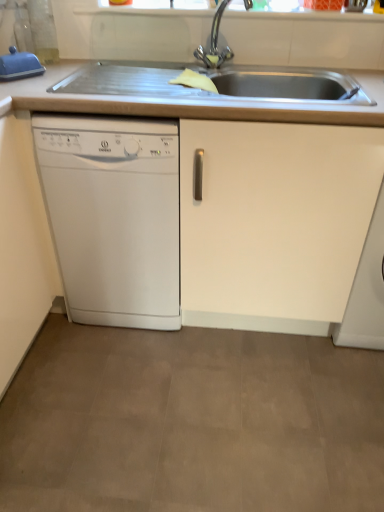
What do you see at coordinates (366, 291) in the screenshot?
I see `white matte cabinet at lower right` at bounding box center [366, 291].

You are a GUI agent. You are given a task and a screenshot of the screen. Output one action in this format:
    pyautogui.click(x=<x>, y=<y>)
    Task: Click on the white matte countertop at upper center
    Image resolution: width=384 pixels, height=512 pixels.
    Given the screenshot: What is the action you would take?
    pyautogui.click(x=179, y=97)

The image size is (384, 512). Identify the location of blue rubber glove at upper left. (19, 65).

Which object is further away from the camera, polished chrome tap at upper center or white matte cabinet at lower right?

polished chrome tap at upper center is more distant.

Which object is positioned more to the left, polished chrome tap at upper center or white matte cabinet at lower right?

polished chrome tap at upper center is more to the left.

From a real-world perspective, is polished chrome tap at upper center positioned over white matte cabinet at lower right based on gravity?

Correct, in the physical world, polished chrome tap at upper center is higher than white matte cabinet at lower right.

Is white plastic dishwasher at left turned away from polished chrome tap at upper center?

No.

Considering the positions of points (77, 280) and (222, 52), is point (77, 280) closer to camera compared to point (222, 52)?

No, (77, 280) is further to viewer.

From the image's perspective, would you say white plastic dishwasher at left is shown under polished chrome tap at upper center?

Indeed, from the image's perspective, white plastic dishwasher at left is shown beneath polished chrome tap at upper center.

From a real-world perspective, is white plastic dishwasher at left located beneath polished chrome tap at upper center?

Yes, from a real-world perspective, white plastic dishwasher at left is beneath polished chrome tap at upper center.

Considering the sizes of white matte cabinet at lower right and white matte countertop at upper center in the image, is white matte cabinet at lower right wider or thinner than white matte countertop at upper center?

Clearly, white matte cabinet at lower right has more width compared to white matte countertop at upper center.

Is white matte cabinet at lower right further to camera compared to white matte countertop at upper center?

Yes, white matte cabinet at lower right is behind white matte countertop at upper center.

Is white matte cabinet at lower right next to white matte countertop at upper center and touching it?

white matte cabinet at lower right and white matte countertop at upper center are clearly separated.

From a real-world perspective, does white matte cabinet at lower right stand above white matte countertop at upper center?

No, from a real-world perspective, white matte cabinet at lower right is not over white matte countertop at upper center

Based on the photo, in the image, is blue rubber glove at upper left on the left side or the right side of white plastic dishwasher at left?

Based on their positions, blue rubber glove at upper left is located to the left of white plastic dishwasher at left.

Could you tell me if blue rubber glove at upper left is facing white plastic dishwasher at left?

No, blue rubber glove at upper left is not turned towards white plastic dishwasher at left.

Which of these two, blue rubber glove at upper left or white plastic dishwasher at left, is wider?

Wider between the two is white plastic dishwasher at left.

Considering the positions of objects white plastic dishwasher at left and white matte cabinet at lower right in the image provided, who is more to the left, white plastic dishwasher at left or white matte cabinet at lower right?

white plastic dishwasher at left is more to the left.

Considering the positions of objects white plastic dishwasher at left and white matte cabinet at lower right in the image provided, who is in front, white plastic dishwasher at left or white matte cabinet at lower right?

white matte cabinet at lower right is in front.

Which of these two, white plastic dishwasher at left or white matte cabinet at lower right, stands shorter?

Standing shorter between the two is white matte cabinet at lower right.

Is polished chrome tap at upper center smaller than white matte countertop at upper center?

Yes.

Considering the sizes of objects polished chrome tap at upper center and white matte countertop at upper center in the image provided, who is shorter, polished chrome tap at upper center or white matte countertop at upper center?

white matte countertop at upper center is shorter.

At what (x,y) coordinates should I click in order to perform the action: click on tap that is behind the white matte countertop at upper center. Please return your answer as a coordinate pair (x, y). Looking at the image, I should click on (215, 42).

What's the angular difference between polished chrome tap at upper center and white matte countertop at upper center's facing directions?

1.15 degrees.

Between blue rubber glove at upper left and white matte cabinet at lower right, which one appears on the right side from the viewer's perspective?

Positioned to the right is white matte cabinet at lower right.

Is blue rubber glove at upper left wider than white matte cabinet at lower right?

In fact, blue rubber glove at upper left might be narrower than white matte cabinet at lower right.

Considering the sizes of objects blue rubber glove at upper left and white matte cabinet at lower right in the image provided, who is taller, blue rubber glove at upper left or white matte cabinet at lower right?

white matte cabinet at lower right is taller.

You are a GUI agent. You are given a task and a screenshot of the screen. Output one action in this format:
    pyautogui.click(x=<x>, y=<y>)
    Task: Click on the tap that is behind the white matte cabinet at lower right
    The width and height of the screenshot is (384, 512).
    Given the screenshot: What is the action you would take?
    pyautogui.click(x=215, y=42)

Locate an element on the screen. This screenshot has height=512, width=384. home appliance lying below the polished chrome tap at upper center (from the image's perspective) is located at coordinates (114, 216).

Estimate the real-world distances between objects in this image. Which object is further from blue rubber glove at upper left, white matte cabinet at lower right or white matte countertop at upper center?

The object further to blue rubber glove at upper left is white matte cabinet at lower right.

Based on their spatial positions, is white plastic dishwasher at left or polished chrome tap at upper center closer to white matte countertop at upper center?

Based on the image, white plastic dishwasher at left appears to be nearer to white matte countertop at upper center.

Based on their spatial positions, is white plastic dishwasher at left or blue rubber glove at upper left further from white matte countertop at upper center?

The object further to white matte countertop at upper center is white plastic dishwasher at left.

Looking at the image, which one is located further to white matte cabinet at lower right, white plastic dishwasher at left or blue rubber glove at upper left?

Among the two, blue rubber glove at upper left is located further to white matte cabinet at lower right.

Looking at the image, which one is located further to blue rubber glove at upper left, white plastic dishwasher at left or white matte cabinet at lower right?

white matte cabinet at lower right is further to blue rubber glove at upper left.

When comparing their distances from blue rubber glove at upper left, does polished chrome tap at upper center or white matte cabinet at lower right seem further?

Based on the image, white matte cabinet at lower right appears to be further to blue rubber glove at upper left.

In the scene shown: When comparing their distances from white matte countertop at upper center, does white matte cabinet at lower right or white plastic dishwasher at left seem closer?

Based on the image, white plastic dishwasher at left appears to be nearer to white matte countertop at upper center.

From the image, which object appears to be farther from white matte cabinet at lower right, white matte countertop at upper center or white plastic dishwasher at left?

The object further to white matte cabinet at lower right is white plastic dishwasher at left.

Find the location of a particular element. The height and width of the screenshot is (512, 384). home appliance located between blue rubber glove at upper left and polished chrome tap at upper center in the left-right direction is located at coordinates (114, 216).

At what (x,y) coordinates should I click in order to perform the action: click on home appliance located between blue rubber glove at upper left and white matte cabinet at lower right in the left-right direction. Please return your answer as a coordinate pair (x, y). This screenshot has width=384, height=512. Looking at the image, I should click on (114, 216).

Where is `home appliance between blue rubber glove at upper left and white matte countertop at upper center in the horizontal direction`? Image resolution: width=384 pixels, height=512 pixels. home appliance between blue rubber glove at upper left and white matte countertop at upper center in the horizontal direction is located at coordinates 114,216.

Where is `tap situated between blue rubber glove at upper left and white matte cabinet at lower right from left to right`? The width and height of the screenshot is (384, 512). tap situated between blue rubber glove at upper left and white matte cabinet at lower right from left to right is located at coordinates (215, 42).